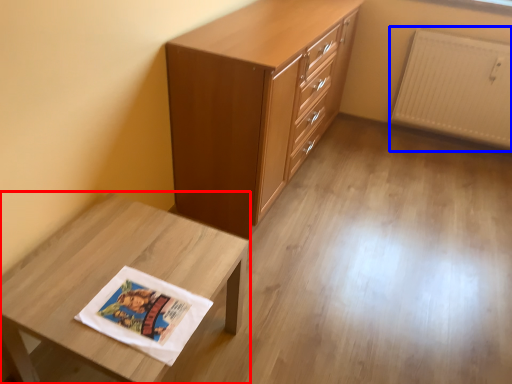
Question: Which point is closer to the camera, table (highlighted by a red box) or radiator (highlighted by a blue box)?

Choices:
 (A) table
 (B) radiator

Answer: (A)